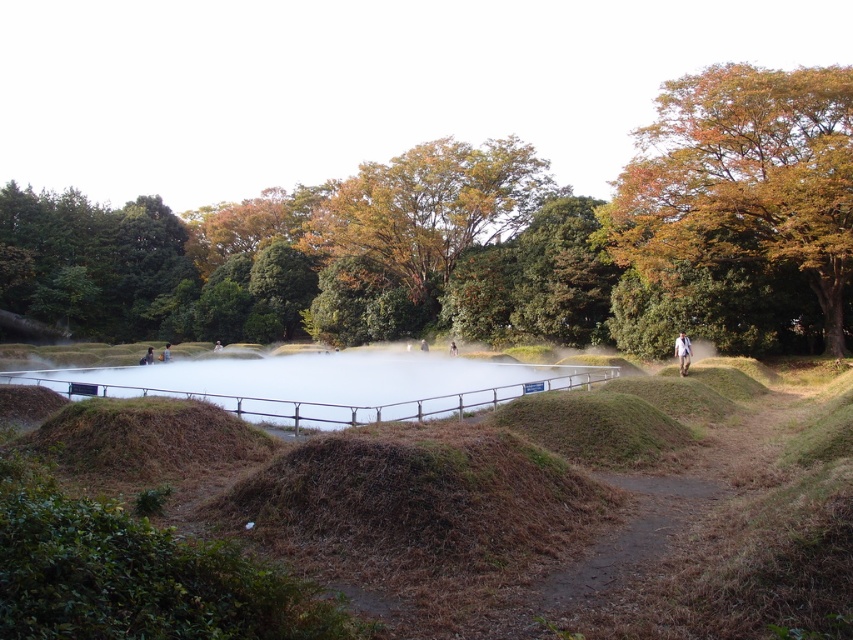
Question: Does autumn leaves tree at center have a greater width compared to brown dirt path at center?

Choices:
 (A) no
 (B) yes

Answer: (B)

Question: Which of the following is the farthest from the observer?

Choices:
 (A) (578, 595)
 (B) (432, 141)
 (C) (164, 358)
 (D) (758, 202)

Answer: (B)

Question: Can you confirm if brown grassy mound at center is wider than light brown fabric bag at center?

Choices:
 (A) yes
 (B) no

Answer: (A)

Question: Which point appears closest to the camera in this image?

Choices:
 (A) (602, 561)
 (B) (68, 317)
 (C) (169, 358)

Answer: (A)

Question: Does orange leafy tree at upper right come behind dark gray fabric jacket at center?

Choices:
 (A) yes
 (B) no

Answer: (B)

Question: Which point is closer to the camera taking this photo?

Choices:
 (A) (343, 340)
 (B) (660, 209)

Answer: (B)